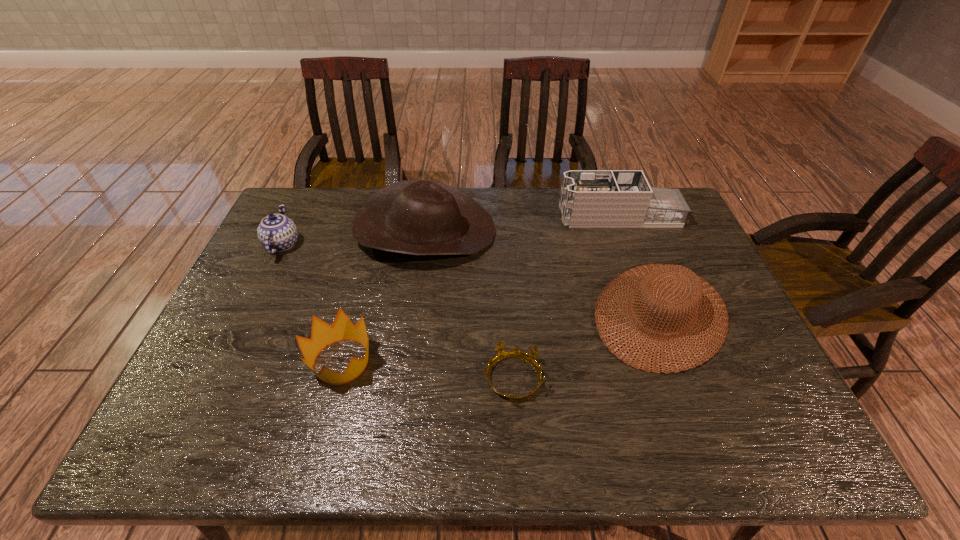
Locate an element on the screen. This screenshot has width=960, height=540. sunhat that is positioned at the right edge is located at coordinates (658, 276).

The image size is (960, 540). Identify the location of object at the far left corner. (276, 232).

Locate an element on the screen. object present at the far right corner is located at coordinates (589, 198).

The height and width of the screenshot is (540, 960). In the image, there is a desktop. Find the location of `free region at the far edge`. free region at the far edge is located at coordinates (514, 188).

Locate an element on the screen. This screenshot has width=960, height=540. vacant space at the near edge of the desktop is located at coordinates (622, 452).

In the image, there is a desktop. Where is `vacant space at the left edge`? vacant space at the left edge is located at coordinates (260, 279).

Locate an element on the screen. This screenshot has width=960, height=540. free space at the right edge of the desktop is located at coordinates (717, 357).

Locate an element on the screen. free spot at the far left corner of the desktop is located at coordinates (304, 227).

In the image, there is a desktop. Where is `vacant region at the near right corner`? This screenshot has width=960, height=540. vacant region at the near right corner is located at coordinates (792, 447).

At what (x,y) coordinates should I click in order to perform the action: click on empty space that is in between the cowboy hat and the dollhouse. Please return your answer as a coordinate pair (x, y). The image size is (960, 540). Looking at the image, I should click on (522, 224).